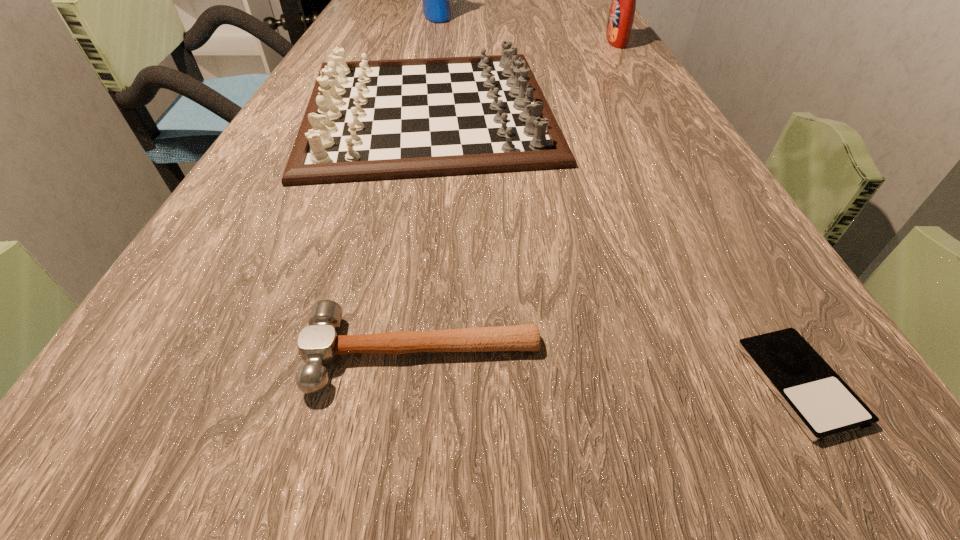
Identify the location of blank space at the left edge of the desktop. This screenshot has width=960, height=540. (309, 214).

In the image, there is a desktop. Identify the location of vacant space at the right edge. This screenshot has width=960, height=540. (684, 205).

At what (x,y) coordinates should I click in order to perform the action: click on vacant area at the far left corner. Please return your answer as a coordinate pair (x, y). Looking at the image, I should click on (396, 2).

Locate an element on the screen. Image resolution: width=960 pixels, height=540 pixels. vacant space at the near right corner of the desktop is located at coordinates click(x=862, y=529).

Find the location of a particular element. vacant point located between the shortest object and the second farthest object is located at coordinates (708, 212).

Identify the location of blank region between the fourth tallest object and the second tallest object. (519, 198).

This screenshot has width=960, height=540. In order to click on free spot between the third farthest object and the shortest object in this screenshot , I will do `click(613, 247)`.

Identify the location of free spot between the third shortest object and the second shortest object. (425, 233).

At what (x,y) coordinates should I click in order to perform the action: click on free space that is in between the shortest object and the hammer. Please return your answer as a coordinate pair (x, y). Looking at the image, I should click on (611, 369).

Find the location of `free space between the shorter detergent and the left detergent`. free space between the shorter detergent and the left detergent is located at coordinates (527, 29).